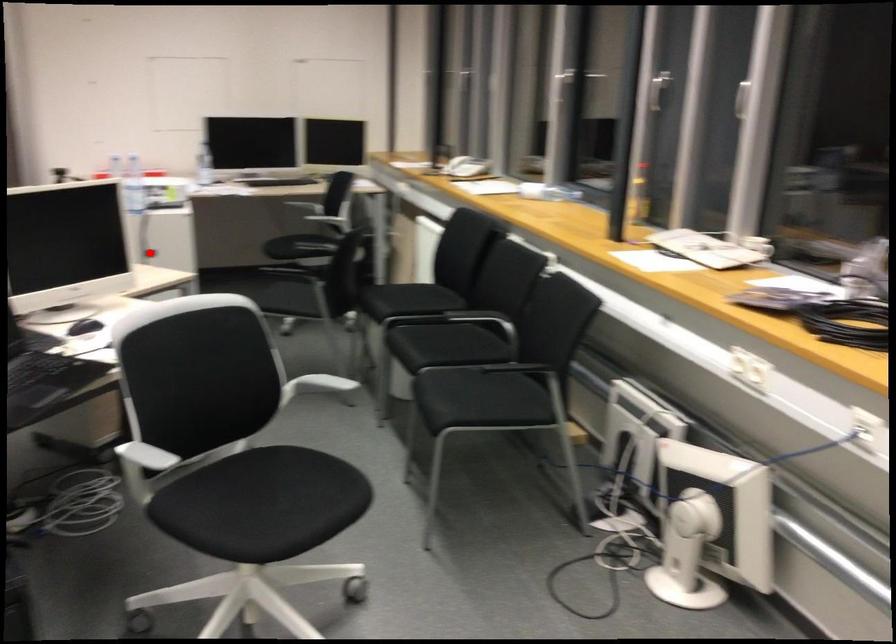
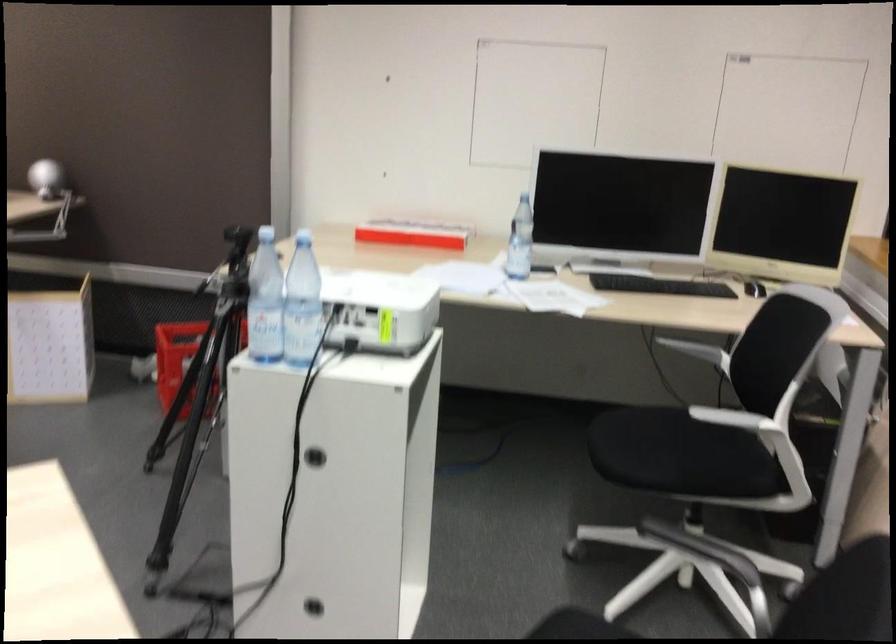
In the second image, find the point that corresponds to the highlighted location in the first image.

(314, 456)